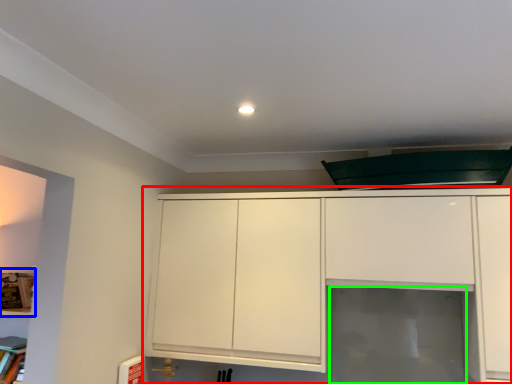
Question: Estimate the real-world distances between objects in this image. Which object is closer to cabinetry (highlighted by a red box), shelf (highlighted by a blue box) or glass door (highlighted by a green box)?

Choices:
 (A) shelf
 (B) glass door

Answer: (B)